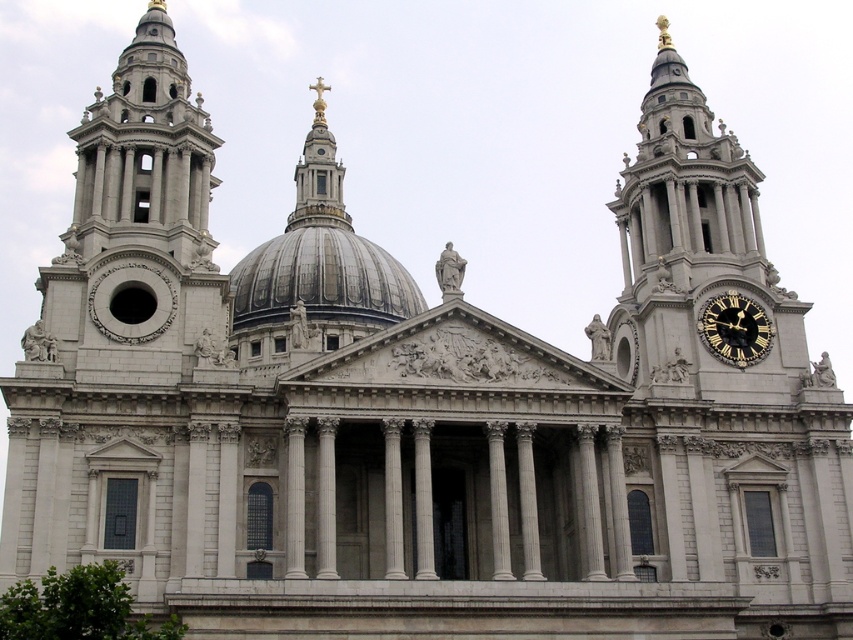
You are an architect visiting St. Paul Cathedral. You notice the shiny silver dome at center and the black polished wood clock at right. Which object is larger in size?

The shiny silver dome at center is bigger than the black polished wood clock at right.

You are standing in front of St. Paul Cathedral and want to take a photo of the shiny silver dome at center. Where should you aim your camera to capture it?

You should aim your camera at point (322, 280) to capture the shiny silver dome at center.